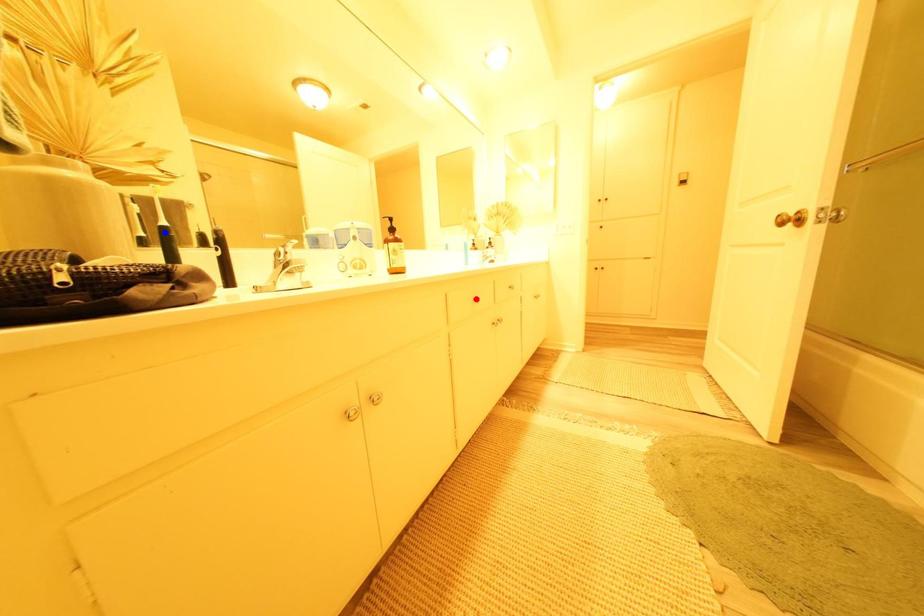
Question: Which of the two points in the image is closer to the camera?

Choices:
 (A) Blue point is closer.
 (B) Red point is closer.

Answer: (A)